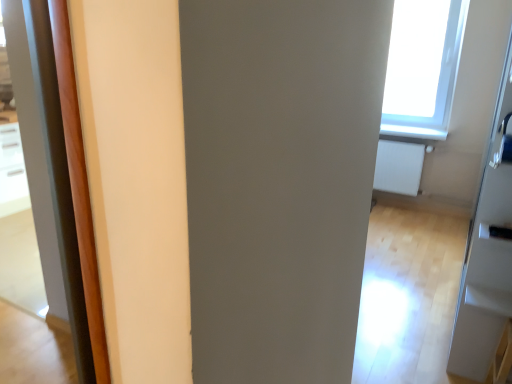
Question: Is satin silver door handle at right, the second door handle ordered from the bottom, inside or outside of transparent glass screen door at upper right?

Choices:
 (A) inside
 (B) outside

Answer: (A)

Question: From a real-world perspective, is satin silver door handle at right, which appears as the 1th door handle when viewed from the top, above or below transparent glass screen door at upper right?

Choices:
 (A) above
 (B) below

Answer: (A)

Question: Which of these objects is positioned farthest from the satin silver door handle at right, which appears as the 1th door handle when viewed from the top?

Choices:
 (A) white matte radiator at right
 (B) transparent glass screen door at upper right
 (C) black plastic door handle at lower right, the second door handle viewed from the top

Answer: (C)

Question: Estimate the real-world distances between objects in this image. Which object is farther from the white matte radiator at right?

Choices:
 (A) satin silver door handle at right, which appears as the 1th door handle when viewed from the top
 (B) black plastic door handle at lower right, the second door handle viewed from the top
 (C) transparent glass screen door at upper right

Answer: (B)